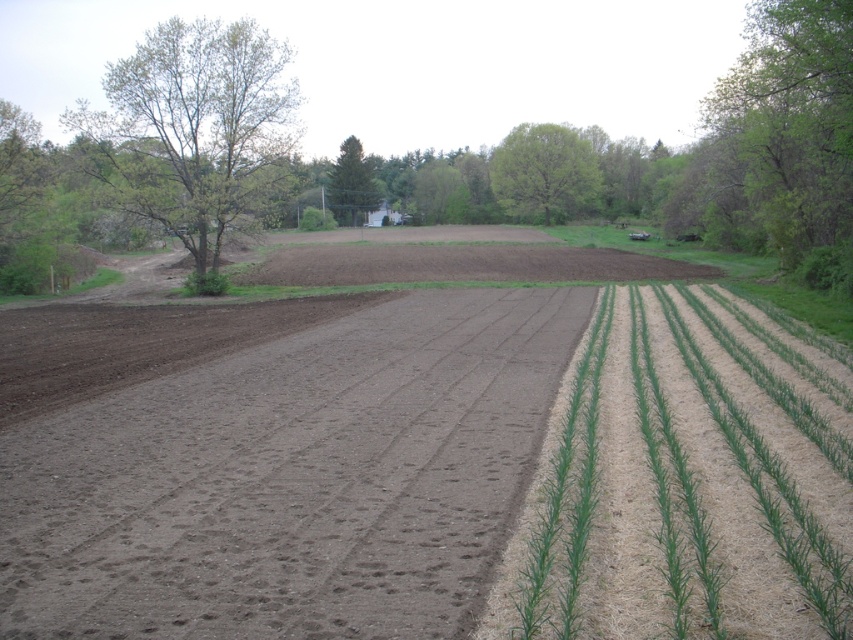
Question: Which of the following is the closest to the observer?

Choices:
 (A) (521, 131)
 (B) (791, 388)
 (C) (51, 625)
 (D) (355, 192)

Answer: (C)

Question: Does brown soil at center appear on the right side of green textured tree at center?

Choices:
 (A) no
 (B) yes

Answer: (B)

Question: Which object is farther from the camera taking this photo?

Choices:
 (A) green textured tree at center
 (B) green leafy tree at upper left
 (C) brown soil at center

Answer: (A)

Question: Is green leafy tree at upper right to the left of green leafy tree at center from the viewer's perspective?

Choices:
 (A) no
 (B) yes

Answer: (A)

Question: From the image, what is the correct spatial relationship of green leafy tree at upper left in relation to green leafy tree at center?

Choices:
 (A) right
 (B) left

Answer: (B)

Question: Which point appears farthest from the camera in this image?

Choices:
 (A) (795, 589)
 (B) (526, 154)

Answer: (B)